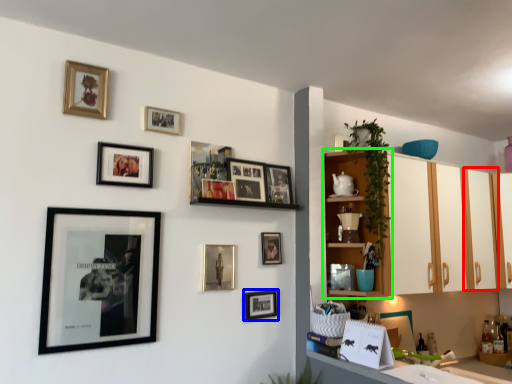
Question: Based on their relative distances, which object is nearer to cabinetry (highlighted by a red box)? Choose from picture frame (highlighted by a blue box) and shelf (highlighted by a green box).

Choices:
 (A) picture frame
 (B) shelf

Answer: (B)